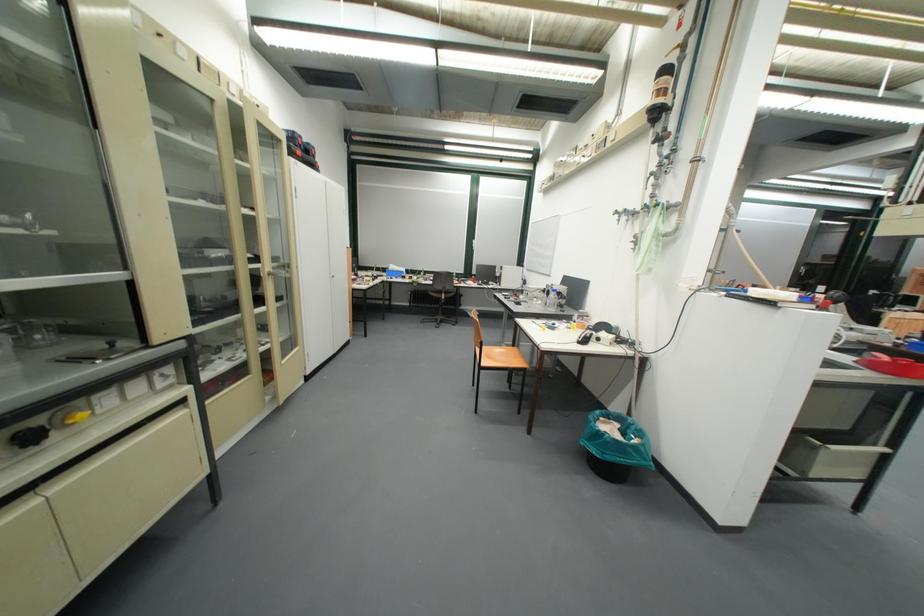
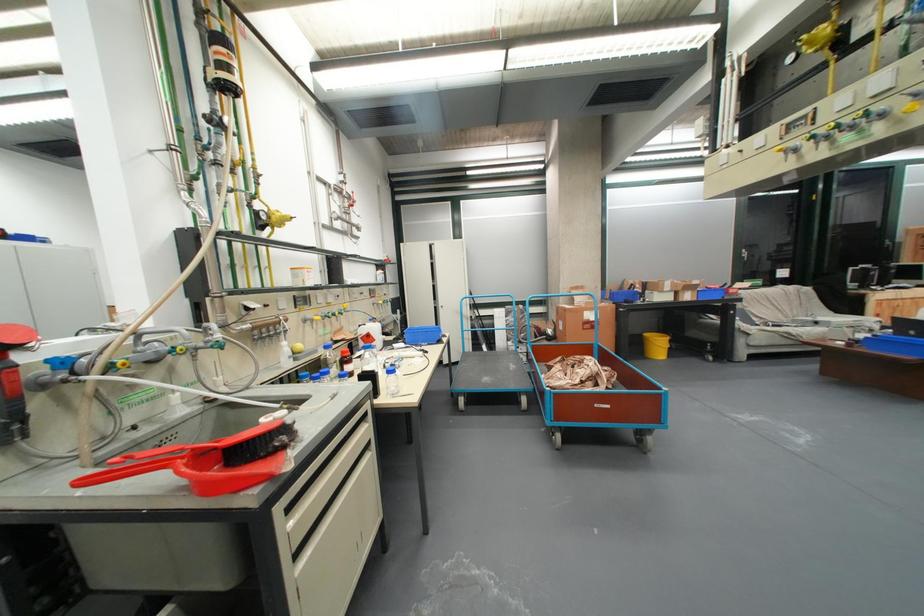
Question: In a continuous first-person perspective shot, in which direction is the camera moving?

Choices:
 (A) Left
 (B) Right
 (C) Forward
 (D) Backward

Answer: (B)